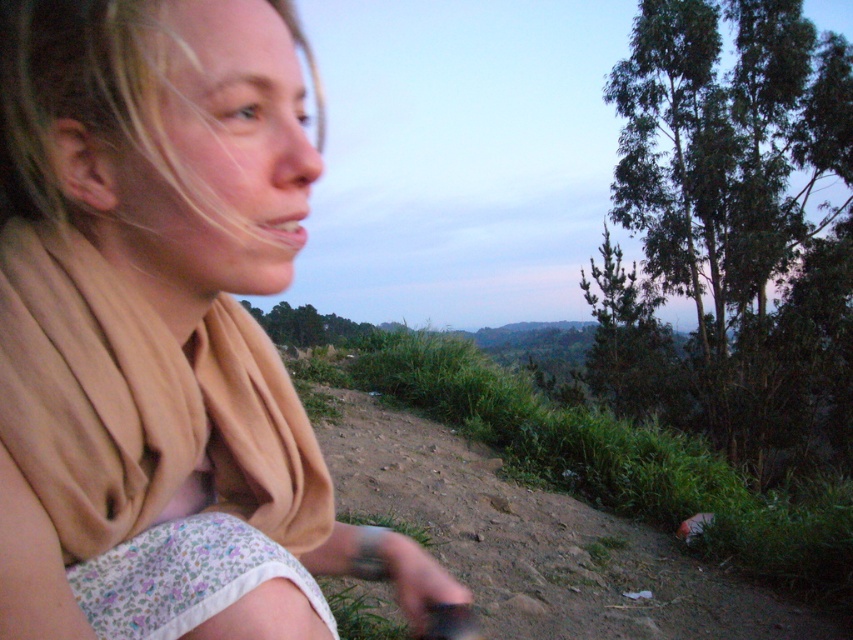
Question: Is beige fabric scarf at upper left wider than brown dirt track at lower center?

Choices:
 (A) no
 (B) yes

Answer: (A)

Question: Among these objects, which one is nearest to the camera?

Choices:
 (A) brown dirt track at lower center
 (B) beige fabric scarf at upper left

Answer: (B)

Question: Does beige fabric scarf at upper left have a larger size compared to brown dirt track at lower center?

Choices:
 (A) no
 (B) yes

Answer: (A)

Question: Among these objects, which one is farthest from the camera?

Choices:
 (A) brown dirt track at lower center
 (B) beige fabric scarf at upper left

Answer: (A)

Question: Does beige fabric scarf at upper left lie behind brown dirt track at lower center?

Choices:
 (A) no
 (B) yes

Answer: (A)